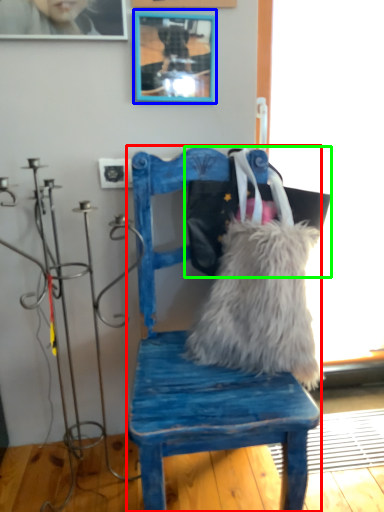
Question: Estimate the real-world distances between objects in this image. Which object is farther from chair (highlighted by a red box), picture frame (highlighted by a blue box) or messenger bag (highlighted by a green box)?

Choices:
 (A) picture frame
 (B) messenger bag

Answer: (A)